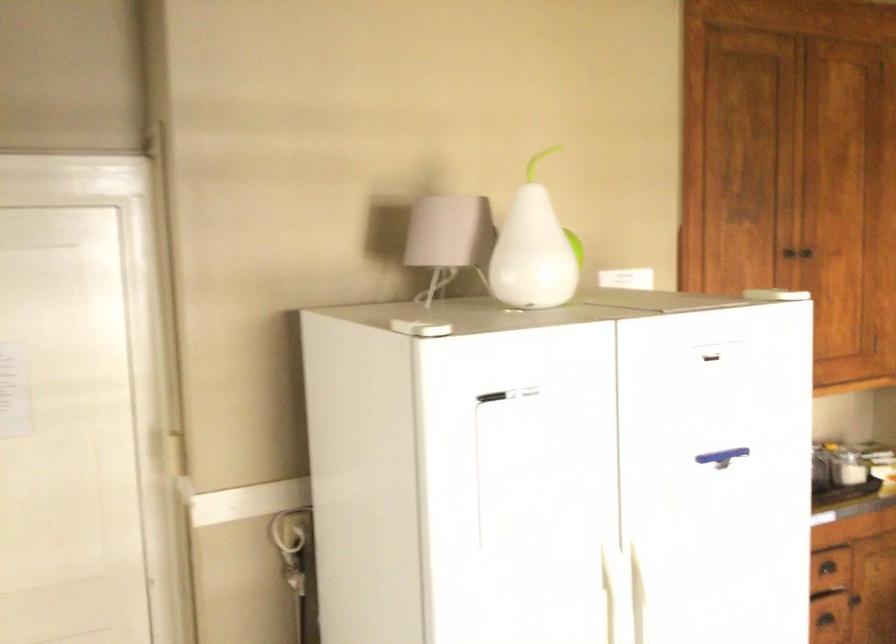
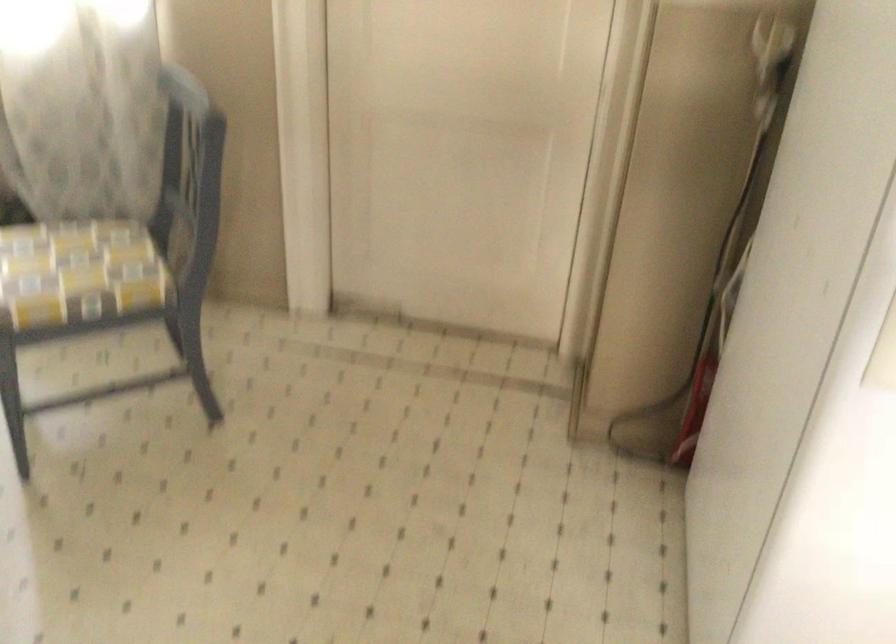
The first image is from the beginning of the video and the second image is from the end. How did the camera likely rotate when shooting the video?

The rotation direction of the camera is left-down.